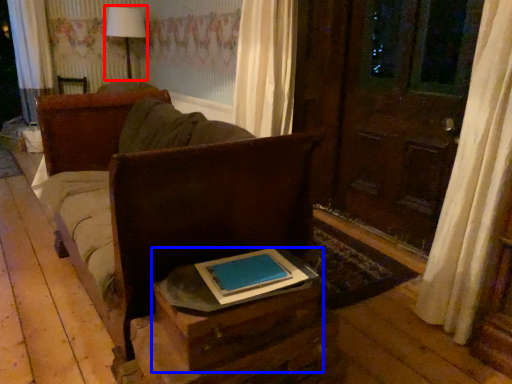
Question: Among these objects, which one is farthest to the camera, table lamp (highlighted by a red box) or table (highlighted by a blue box)?

Choices:
 (A) table lamp
 (B) table

Answer: (A)